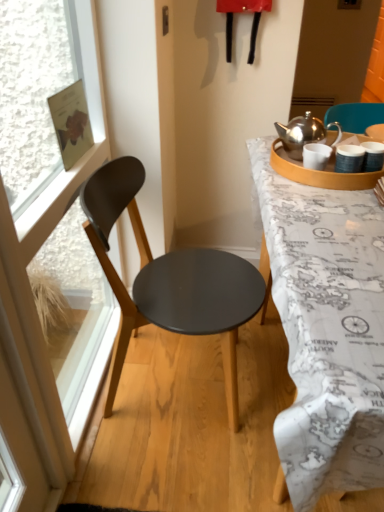
What is the approximate height of white matte coffee cup at upper right?

The height of white matte coffee cup at upper right is 9.36 centimeters.

Describe the element at coordinates (47, 248) in the screenshot. This screenshot has width=384, height=512. I see `transparent glass window at left` at that location.

Image resolution: width=384 pixels, height=512 pixels. In order to click on white map-covered desk at right in this screenshot , I will do `click(326, 330)`.

Does matte black chair at left have a greater width compared to white matte coffee cup at upper right?

Indeed, matte black chair at left has a greater width compared to white matte coffee cup at upper right.

Considering the relative sizes of matte black chair at left and white matte coffee cup at upper right in the image provided, is matte black chair at left taller than white matte coffee cup at upper right?

Yes, matte black chair at left is taller than white matte coffee cup at upper right.

Who is bigger, matte black chair at left or white matte coffee cup at upper right?

matte black chair at left is bigger.

From a real-world perspective, relative to white matte coffee cup at upper right, is matte black chair at left vertically above or below?

Clearly, from a real-world perspective, matte black chair at left is below white matte coffee cup at upper right.

Which object is further away from the camera, white map-covered desk at right or transparent glass window at left?

white map-covered desk at right is further from the camera.

Can you confirm if white map-covered desk at right is positioned to the right of transparent glass window at left?

Correct, you'll find white map-covered desk at right to the right of transparent glass window at left.

From the image's perspective, does white map-covered desk at right appear higher than transparent glass window at left?

No, from the image's perspective, white map-covered desk at right is not on top of transparent glass window at left.

Is white map-covered desk at right wider or thinner than transparent glass window at left?

white map-covered desk at right is wider than transparent glass window at left.

Consider the image. Which is in front, matte black chair at left or transparent glass window at left?

transparent glass window at left is closer to the camera.

Does matte black chair at left have a larger size compared to transparent glass window at left?

Yes, matte black chair at left is bigger than transparent glass window at left.

Which point is more forward, (107, 406) or (11, 63)?

The point (107, 406) is more forward.

Is matte black chair at left aimed at transparent glass window at left?

No.

Consider the image. Between matte black chair at left and white map-covered desk at right, which one has larger width?

white map-covered desk at right.

Is matte black chair at left positioned far away from white map-covered desk at right?

No, matte black chair at left is not far away from white map-covered desk at right.

From a real-world perspective, which is physically below, matte black chair at left or white map-covered desk at right?

In real-world perspective, white map-covered desk at right is lower.

Is matte black chair at left looking in the opposite direction of white map-covered desk at right?

matte black chair at left does not have its back to white map-covered desk at right.

From the image's perspective, who appears lower, white matte coffee cup at upper right or transparent glass window at left?

transparent glass window at left.

Which is further, (307,144) or (77,143)?

Positioned behind is point (307,144).

Which of these two, white matte coffee cup at upper right or transparent glass window at left, is thinner?

Thinner between the two is transparent glass window at left.

Is white matte coffee cup at upper right oriented away from transparent glass window at left?

That's right, white matte coffee cup at upper right is facing away from transparent glass window at left.

From the image's perspective, is transparent glass window at left positioned above or below matte black chair at left?

transparent glass window at left is situated higher than matte black chair at left in the image.

From a real-world perspective, is transparent glass window at left over matte black chair at left?

Yes, from a real-world perspective, transparent glass window at left is on top of matte black chair at left.

Does transparent glass window at left have a lesser height compared to matte black chair at left?

In fact, transparent glass window at left may be taller than matte black chair at left.

Can you confirm if transparent glass window at left is smaller than matte black chair at left?

Correct, transparent glass window at left occupies less space than matte black chair at left.

What's the angular difference between white matte coffee cup at upper right and white map-covered desk at right's facing directions?

4.53 degrees.

Between white matte coffee cup at upper right and white map-covered desk at right, which one appears on the left side from the viewer's perspective?

From the viewer's perspective, white matte coffee cup at upper right appears more on the left side.

Where is `coffee cup located above the white map-covered desk at right (from a real-world perspective)`? This screenshot has height=512, width=384. coffee cup located above the white map-covered desk at right (from a real-world perspective) is located at coordinates (316, 155).

Looking at this image, from the image's perspective, is white matte coffee cup at upper right located beneath white map-covered desk at right?

No, from the image's perspective, white matte coffee cup at upper right is not below white map-covered desk at right.

Locate an element on the screen. The height and width of the screenshot is (512, 384). chair lying in front of the white matte coffee cup at upper right is located at coordinates click(x=169, y=279).

This screenshot has width=384, height=512. I want to click on desk behind the transparent glass window at left, so (326, 330).

From the image, which object appears to be nearer to matte black chair at left, white matte coffee cup at upper right or transparent glass window at left?

The object closer to matte black chair at left is transparent glass window at left.

Considering their positions, is white map-covered desk at right positioned further to transparent glass window at left than matte black chair at left?

white map-covered desk at right.

Considering their positions, is white map-covered desk at right positioned closer to white matte coffee cup at upper right than matte black chair at left?

white map-covered desk at right.

When comparing their distances from white map-covered desk at right, does matte black chair at left or transparent glass window at left seem closer?

The object closer to white map-covered desk at right is matte black chair at left.

Estimate the real-world distances between objects in this image. Which object is closer to white matte coffee cup at upper right, transparent glass window at left or white map-covered desk at right?

Among the two, white map-covered desk at right is located nearer to white matte coffee cup at upper right.

Looking at the image, which one is located further to white map-covered desk at right, white matte coffee cup at upper right or matte black chair at left?

white matte coffee cup at upper right is further to white map-covered desk at right.

From the image, which object appears to be nearer to white map-covered desk at right, matte black chair at left or white matte coffee cup at upper right?

matte black chair at left.

Looking at the image, which one is located closer to transparent glass window at left, white matte coffee cup at upper right or matte black chair at left?

matte black chair at left.

This screenshot has width=384, height=512. Find the location of `chair between transparent glass window at left and white matte coffee cup at upper right along the z-axis`. chair between transparent glass window at left and white matte coffee cup at upper right along the z-axis is located at coordinates (169, 279).

Where is `coffee cup between transparent glass window at left and white map-covered desk at right from left to right`? This screenshot has height=512, width=384. coffee cup between transparent glass window at left and white map-covered desk at right from left to right is located at coordinates (316, 155).

The image size is (384, 512). I want to click on chair between white map-covered desk at right and white matte coffee cup at upper right from front to back, so point(169,279).

In order to click on chair between transparent glass window at left and white map-covered desk at right in this screenshot , I will do `click(169, 279)`.